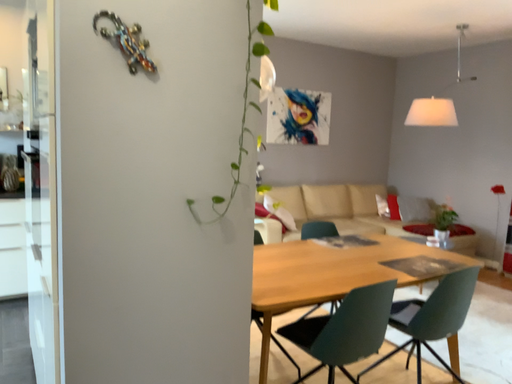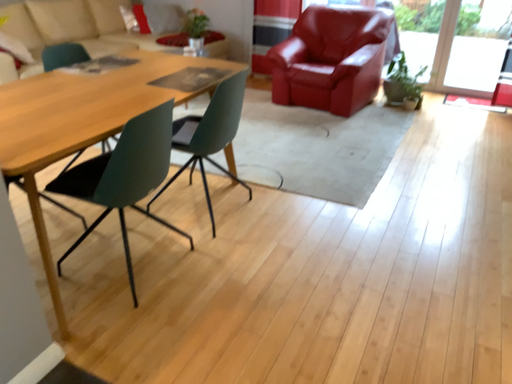
Question: Which way did the camera rotate in the video?

Choices:
 (A) rotated left
 (B) rotated right

Answer: (B)